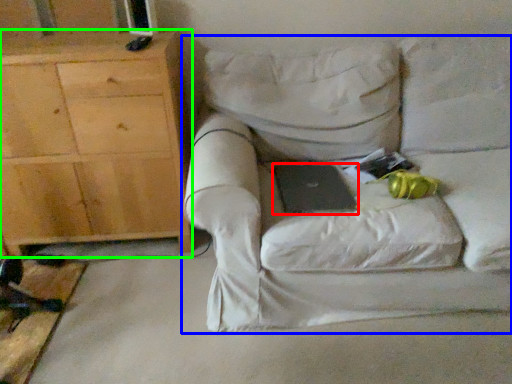
Question: Which is farther away from laptop (highlighted by a red box)? chair (highlighted by a blue box) or cabinetry (highlighted by a green box)?

Choices:
 (A) chair
 (B) cabinetry

Answer: (B)